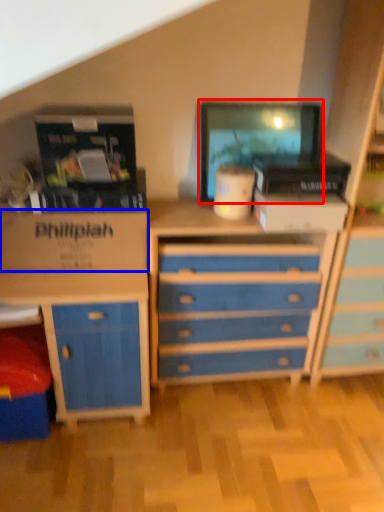
Question: Which object is further to the camera taking this photo, computer monitor (highlighted by a red box) or cardboard box (highlighted by a blue box)?

Choices:
 (A) computer monitor
 (B) cardboard box

Answer: (A)